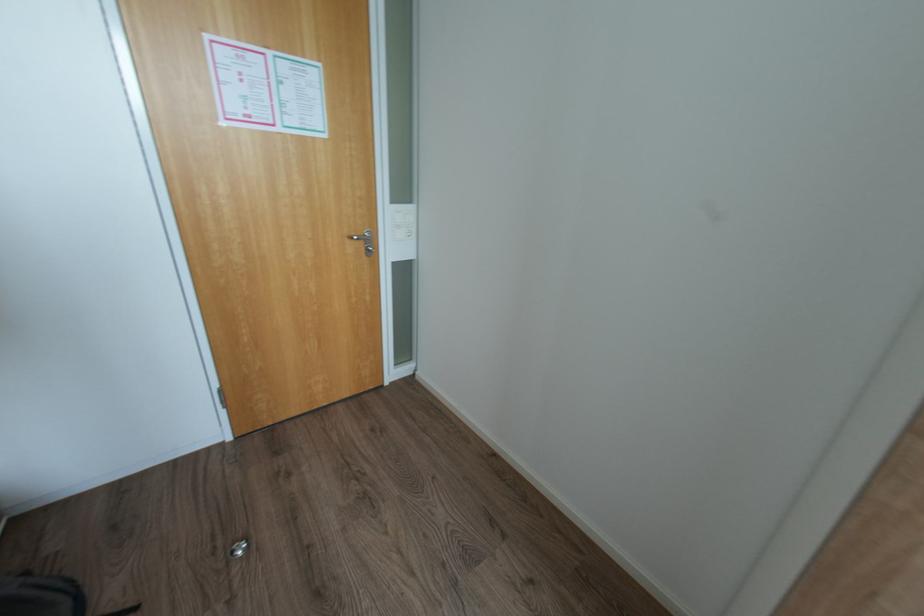
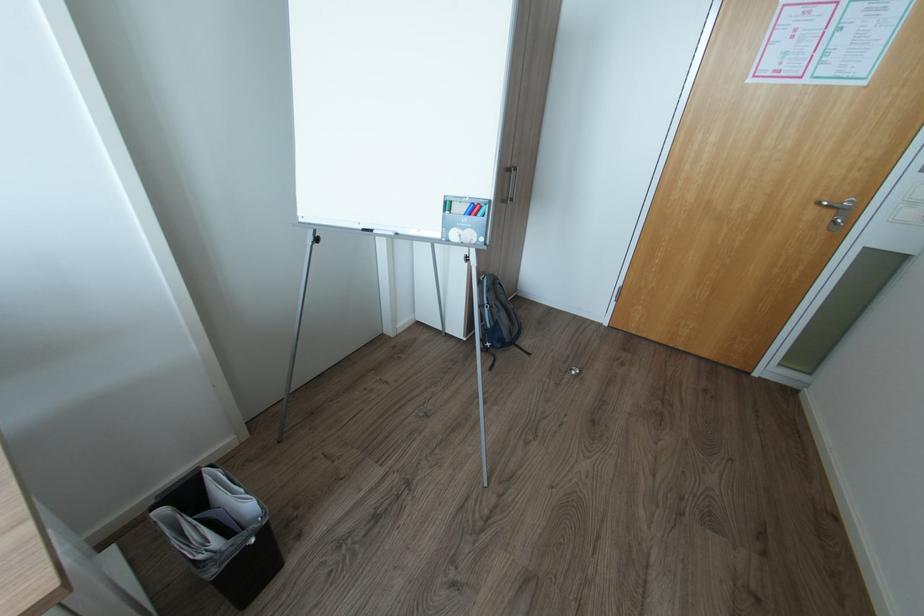
Where in the second image is the point corresponding to [377,248] from the first image?

(845, 221)